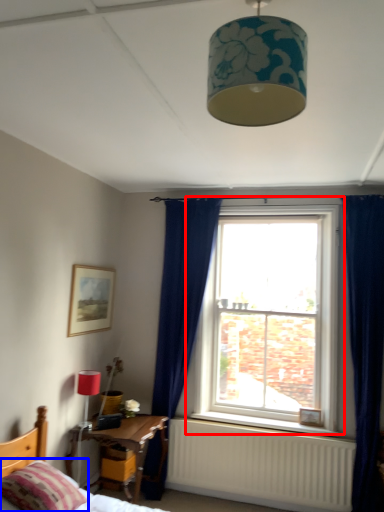
Question: Among these objects, which one is nearest to the camera, window (highlighted by a red box) or pillow (highlighted by a blue box)?

Choices:
 (A) window
 (B) pillow

Answer: (B)